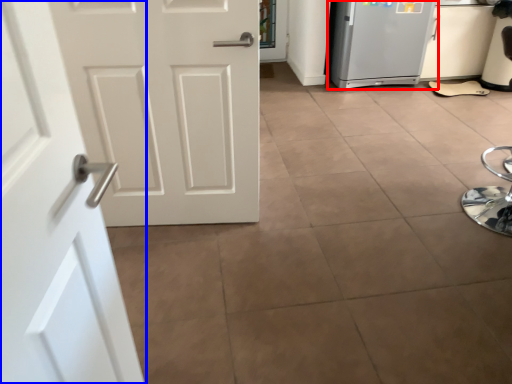
Question: Which object is closer to the camera taking this photo, refrigerator (highlighted by a red box) or door (highlighted by a blue box)?

Choices:
 (A) refrigerator
 (B) door

Answer: (B)